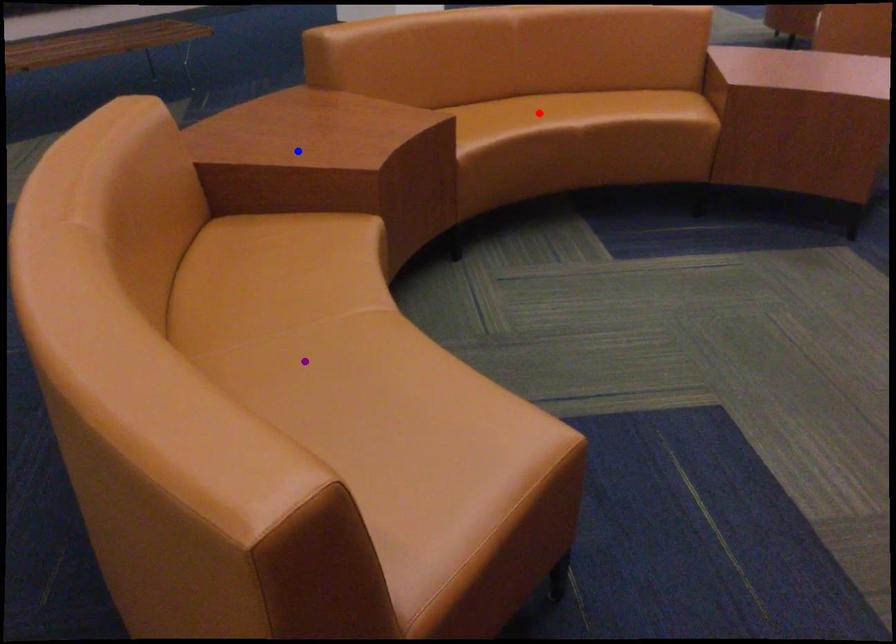
In the scene shown: Order these from nearest to farthest:
purple point
red point
blue point

1. purple point
2. blue point
3. red point